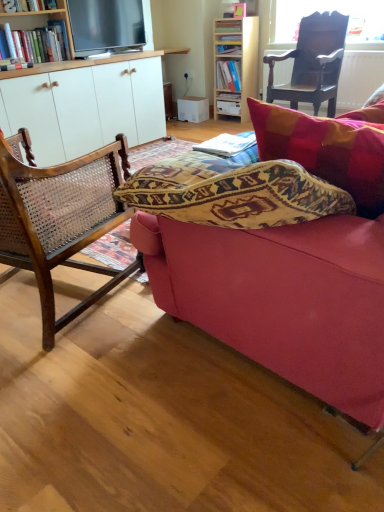
Locate an element on the screen. free space on the front side of wooden cane chair at left, placed as the 2th chair when sorted from top to bottom is located at coordinates (84, 390).